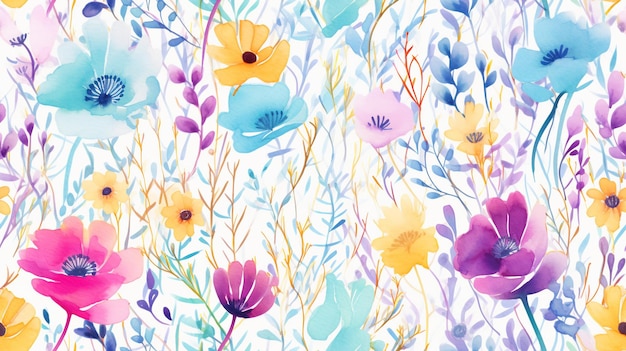
Identify the location of flowers on the left. Image resolution: width=626 pixels, height=351 pixels. (22, 25), (78, 59), (86, 279), (94, 174), (33, 304).